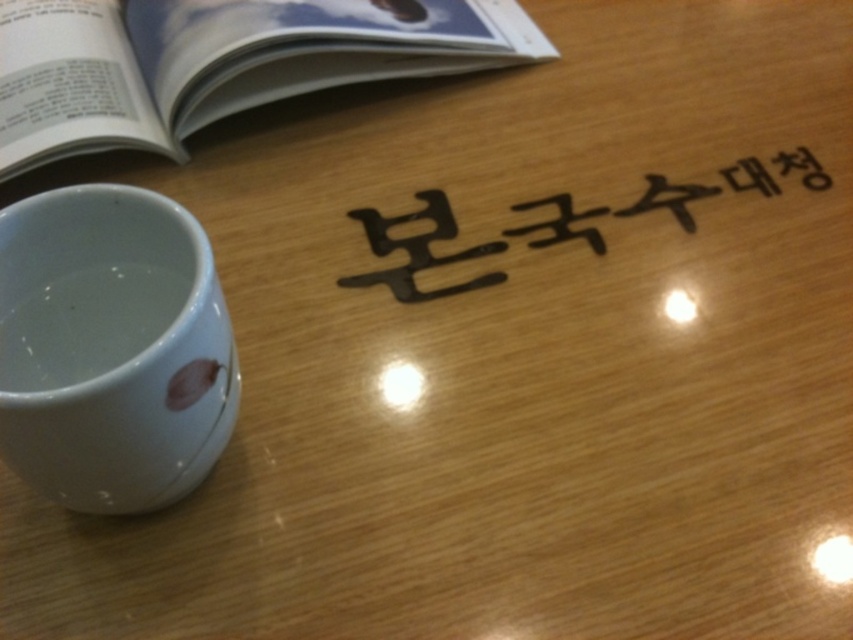
Question: Which of the following is the closest to the observer?

Choices:
 (A) white glossy mug at lower left
 (B) matte paper book at upper left

Answer: (A)

Question: Among these objects, which one is nearest to the camera?

Choices:
 (A) black matte sign at center
 (B) white glossy mug at lower left
 (C) matte paper book at upper left

Answer: (B)

Question: Is white glossy mug at lower left positioned in front of matte paper book at upper left?

Choices:
 (A) no
 (B) yes

Answer: (B)

Question: Which is farther from the white glossy mug at lower left?

Choices:
 (A) matte paper book at upper left
 (B) black matte sign at center

Answer: (A)

Question: Where is white glossy mug at lower left located in relation to matte paper book at upper left in the image?

Choices:
 (A) above
 (B) below

Answer: (B)

Question: Can you confirm if white glossy mug at lower left is positioned below matte paper book at upper left?

Choices:
 (A) no
 (B) yes

Answer: (B)